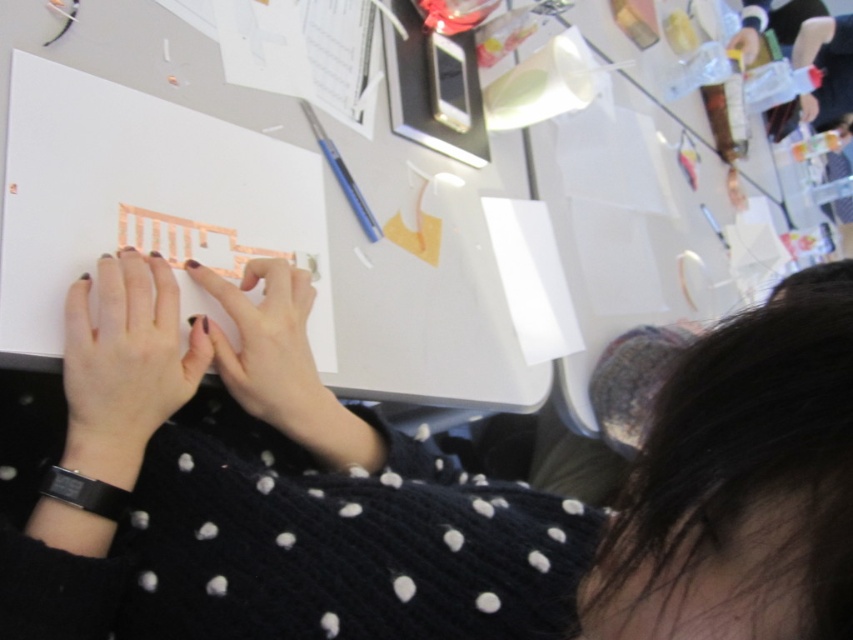
Question: Which point is closer to the camera?

Choices:
 (A) coord(225,282)
 (B) coord(525,488)

Answer: (B)

Question: Is matte pink paper at center wider than blue plastic pencil at upper right?

Choices:
 (A) no
 (B) yes

Answer: (B)

Question: Does blue plastic pencil at upper right have a lesser width compared to metallic gold paper at upper center?

Choices:
 (A) yes
 (B) no

Answer: (A)

Question: Which of the following is the closest to the observer?

Choices:
 (A) matte pink paper at center
 (B) metallic gold paper at upper center
 (C) nail polish matte hand at center

Answer: (A)

Question: Which is nearer to the blue plastic pencil at upper right?

Choices:
 (A) metallic gold paper at upper center
 (B) matte pink paper at center

Answer: (B)

Question: Is nail polish matte hand at center below blue plastic pencil at upper right?

Choices:
 (A) yes
 (B) no

Answer: (A)